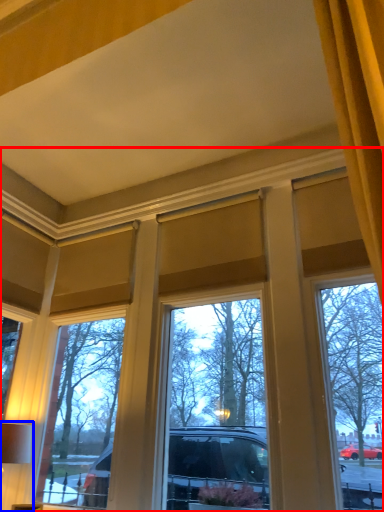
Question: Which of the following is the closest to the observer, window (highlighted by a red box) or table lamp (highlighted by a blue box)?

Choices:
 (A) window
 (B) table lamp

Answer: (A)